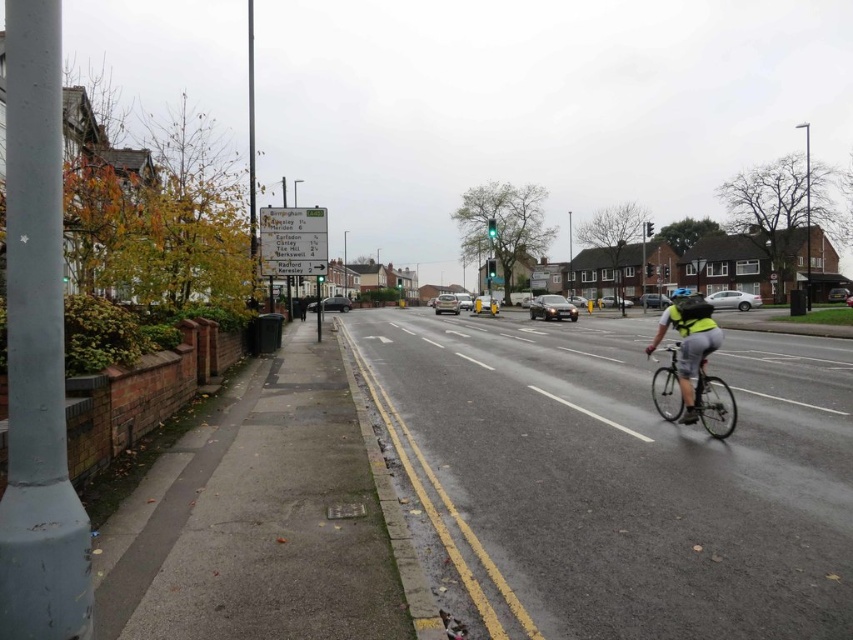
Does reflective silver cycling gear at center-right have a smaller size compared to silver metallic bicycle at center-right?

No.

Is reflective silver cycling gear at center-right wider than silver metallic bicycle at center-right?

Yes.

Between point (697, 417) and point (709, 426), which one is positioned behind?

Positioned behind is point (697, 417).

What are the coordinates of `reflective silver cycling gear at center-right` in the screenshot? It's located at (689, 346).

Who is more distant from viewer, [267,212] or [676,324]?

The point [267,212] is more distant.

Is metallic rectangular sign at center-left positioned at the back of reflective silver cycling gear at center-right?

Yes.

Who is more forward, [310,236] or [672,310]?

Point [672,310] is more forward.

Find the location of a particular element. The height and width of the screenshot is (640, 853). metallic rectangular sign at center-left is located at coordinates (292, 241).

Between metallic rectangular sign at center-left and matte black helmet at center, which one appears on the right side from the viewer's perspective?

Positioned to the right is matte black helmet at center.

Locate an element on the screen. metallic rectangular sign at center-left is located at coordinates (292, 241).

Is point (317, 266) closer to viewer compared to point (671, 300)?

Yes, point (317, 266) is in front of point (671, 300).

Where is `metallic rectangular sign at center-left`? The width and height of the screenshot is (853, 640). metallic rectangular sign at center-left is located at coordinates (292, 241).